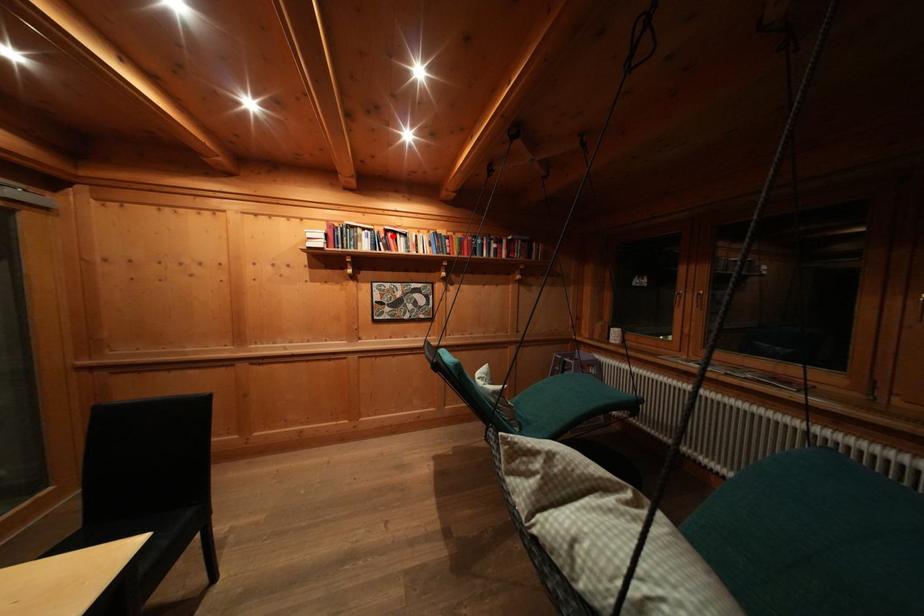
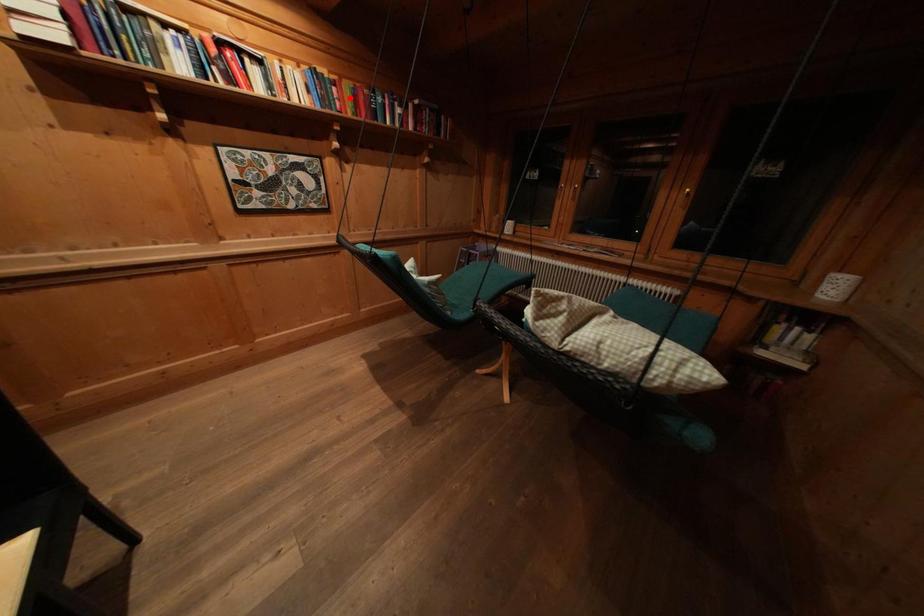
I am providing you with two images of the same scene from different viewpoints. A red point is marked on the first image and another point is marked on the second image. Does the point marked in image1 correspond to the same location as the one in image2?

No